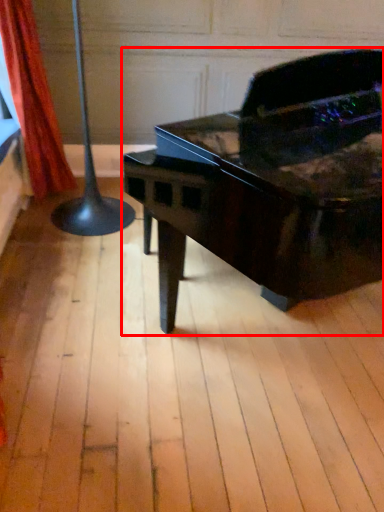
Question: From the image's perspective, considering the relative positions of piano (annotated by the red box) and curtain in the image provided, where is piano (annotated by the red box) located with respect to the staircase?

Choices:
 (A) below
 (B) above

Answer: (A)